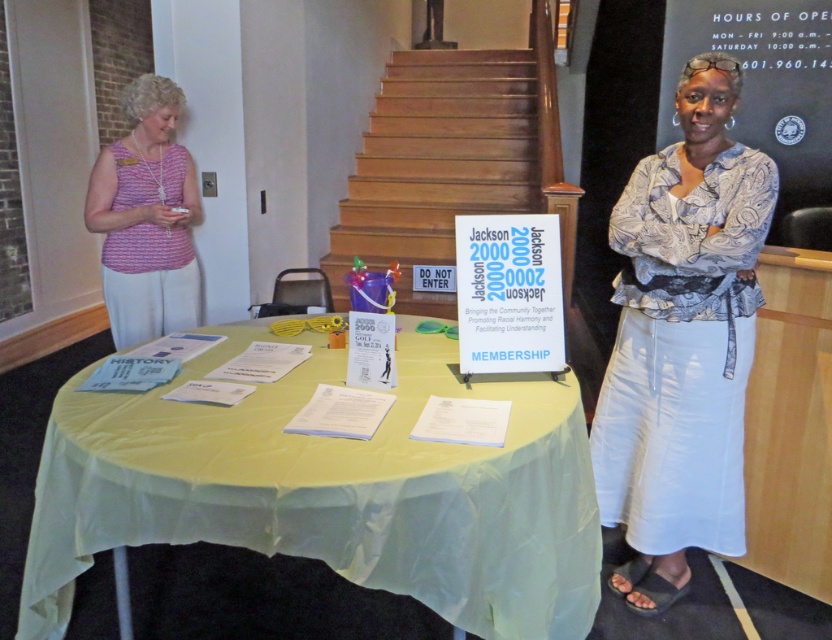
Is yellow fabric-covered table at center taller than wooden stairs at center?

No.

Is point (397, 584) closer to viewer compared to point (416, 132)?

Yes, it is in front of point (416, 132).

I want to click on yellow fabric-covered table at center, so click(x=330, y=490).

Measure the distance between point (484, 168) and camera.

They are 5.22 meters apart.

Is wooden stairs at center to the left of pink fabric blouse at left from the viewer's perspective?

In fact, wooden stairs at center is to the right of pink fabric blouse at left.

The width and height of the screenshot is (832, 640). In order to click on wooden stairs at center in this screenshot , I will do `click(438, 164)`.

Can you confirm if paisley-patterned blouse at center is taller than pink fabric blouse at left?

Indeed, paisley-patterned blouse at center has a greater height compared to pink fabric blouse at left.

The height and width of the screenshot is (640, 832). Describe the element at coordinates (682, 340) in the screenshot. I see `paisley-patterned blouse at center` at that location.

At what (x,y) coordinates should I click in order to perform the action: click on paisley-patterned blouse at center. Please return your answer as a coordinate pair (x, y). This screenshot has width=832, height=640. Looking at the image, I should click on (682, 340).